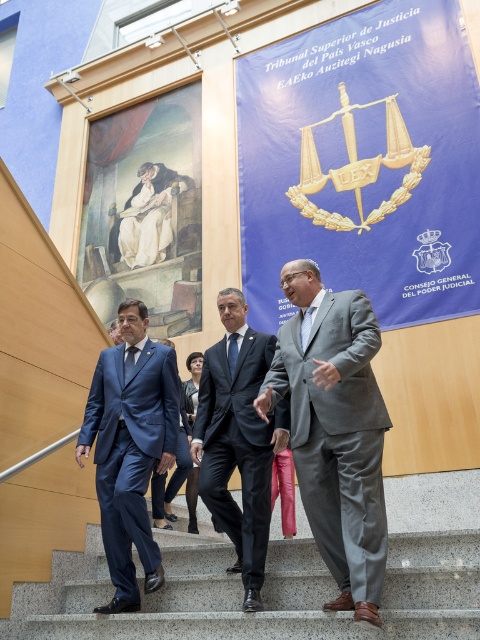
You are standing in front of the banner at the Tribunal Superior de Justicia del Pais Vasco. There is a point marked at coordinates point (447, 243). If you want to touch this point with a 10 meter long pole, will you be able to reach it?

The point (447, 243) is 9.76 meters away from the viewer. Since the pole is 10 meters long, you can reach it.

You are an architect designing a new courtroom. You have to place a blue fabric banner at center and granite stairs at center. Considering their sizes, which object should be placed closer to the entrance to ensure proper visibility?

The blue fabric banner at center is bigger than the granite stairs at center, so placing the blue fabric banner at center closer to the entrance will ensure its larger size is visible and impactful from the entrance.

You are an architect reviewing the layout of this judicial courtroom. You need to install a new sensor that must be placed closer to the viewer than the existing sensor at point (121,355). Is the existing sensor at point (216,545) a suitable location for this new sensor?

Yes, the existing sensor at point (216,545) is closer to the viewer than the existing sensor at point (121,355), so it is a suitable location for the new sensor.